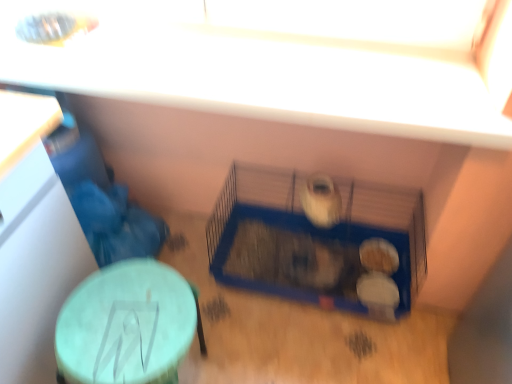
What do you see at coordinates (319, 239) in the screenshot? The height and width of the screenshot is (384, 512). I see `blue wire bird cage at center` at bounding box center [319, 239].

The image size is (512, 384). What are the coordinates of `blue wire bird cage at center` in the screenshot? It's located at (319, 239).

Could you tell me if green matte table at lower left is turned towards blue wire bird cage at center?

No, green matte table at lower left is not facing towards blue wire bird cage at center.

Is green matte table at lower left situated inside blue wire bird cage at center or outside?

The correct answer is: outside.

Measure the distance between green matte table at lower left and blue wire bird cage at center.

green matte table at lower left and blue wire bird cage at center are 24.06 inches apart.

In the image, is green matte table at lower left on the left side or the right side of blue wire bird cage at center?

Based on their positions, green matte table at lower left is located to the left of blue wire bird cage at center.

Is blue wire bird cage at center positioned far away from green matte table at lower left?

They are positioned close to each other.

Considering the relative sizes of blue wire bird cage at center and green matte table at lower left in the image provided, is blue wire bird cage at center wider than green matte table at lower left?

Correct, the width of blue wire bird cage at center exceeds that of green matte table at lower left.

Is blue wire bird cage at center to the left of green matte table at lower left from the viewer's perspective?

In fact, blue wire bird cage at center is to the right of green matte table at lower left.

Considering their positions, is blue wire bird cage at center located in front of or behind green matte table at lower left?

Clearly, blue wire bird cage at center is behind green matte table at lower left.

What's the angular difference between blue plastic cage at center and green matte table at lower left's facing directions?

The angular difference between blue plastic cage at center and green matte table at lower left is 92 degrees.

Between blue plastic cage at center and green matte table at lower left, which one has smaller width?

With smaller width is blue plastic cage at center.

Is blue plastic cage at center completely or partially outside of green matte table at lower left?

blue plastic cage at center is positioned outside green matte table at lower left.

From the image's perspective, is blue plastic cage at center located above or below green matte table at lower left?

blue plastic cage at center is situated higher than green matte table at lower left in the image.

From the image's perspective, which object appears higher, blue plastic cage at center or blue wire bird cage at center?

blue wire bird cage at center appears higher in the image.

Is there a large distance between blue plastic cage at center and blue wire bird cage at center?

No, blue plastic cage at center is not far from blue wire bird cage at center.

Does blue plastic cage at center have a lesser width compared to blue wire bird cage at center?

Yes.

How different are the orientations of blue wire bird cage at center and blue plastic cage at center in degrees?

blue wire bird cage at center and blue plastic cage at center are facing 2.48 degrees away from each other.

Who is more distant, blue wire bird cage at center or blue plastic cage at center?

blue plastic cage at center.

Is blue wire bird cage at center next to blue plastic cage at center and touching it?

Indeed, blue wire bird cage at center and blue plastic cage at center are beside each other and touching.

Consider the image. From the image's perspective, is blue wire bird cage at center beneath blue plastic cage at center?

No, from the image's perspective, blue wire bird cage at center is not beneath blue plastic cage at center.

From a real-world perspective, does green matte table at lower left stand above blue plastic cage at center?

Indeed, from a real-world perspective, green matte table at lower left stands above blue plastic cage at center.

Considering the relative sizes of green matte table at lower left and blue plastic cage at center in the image provided, is green matte table at lower left shorter than blue plastic cage at center?

No, green matte table at lower left is not shorter than blue plastic cage at center.

Is green matte table at lower left situated inside blue plastic cage at center or outside?

green matte table at lower left lies outside blue plastic cage at center.

Is green matte table at lower left further to camera compared to blue plastic cage at center?

That is False.

You are a GUI agent. You are given a task and a screenshot of the screen. Output one action in this format:
    pyautogui.click(x=<x>, y=<y>)
    Task: Click on the table on the left of blue wire bird cage at center
    
    Given the screenshot: What is the action you would take?
    pyautogui.click(x=127, y=325)

Image resolution: width=512 pixels, height=384 pixels. I want to click on bird cage that appears below the green matte table at lower left (from a real-world perspective), so click(319, 239).

Estimate the real-world distances between objects in this image. Which object is further from blue wire bird cage at center, blue plastic cage at center or green matte table at lower left?

Based on the image, green matte table at lower left appears to be further to blue wire bird cage at center.

Looking at the image, which one is located further to green matte table at lower left, blue wire bird cage at center or blue plastic cage at center?

blue plastic cage at center.

Which object lies nearer to the anchor point blue plastic cage at center, blue wire bird cage at center or green matte table at lower left?

blue wire bird cage at center.

Considering their positions, is green matte table at lower left positioned further to blue wire bird cage at center than blue plastic cage at center?

The object further to blue wire bird cage at center is green matte table at lower left.

Looking at the image, which one is located closer to blue plastic cage at center, green matte table at lower left or blue wire bird cage at center?

blue wire bird cage at center is closer to blue plastic cage at center.

When comparing their distances from green matte table at lower left, does blue plastic cage at center or blue wire bird cage at center seem closer?

blue wire bird cage at center is positioned closer to the anchor green matte table at lower left.

Locate an element on the screen. The image size is (512, 384). bird cage between green matte table at lower left and blue plastic cage at center in the front-back direction is located at coordinates (319, 239).